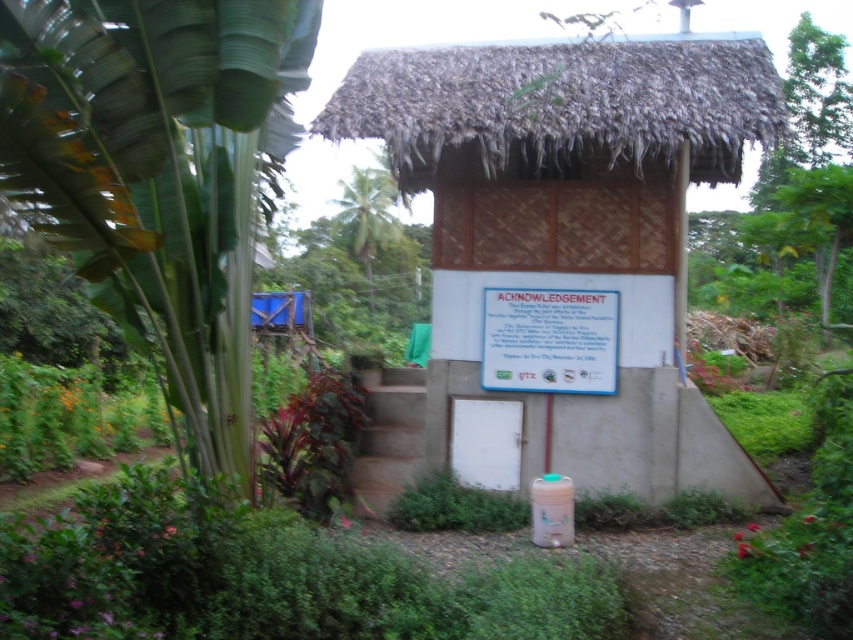
Question: Which point is closer to the camera taking this photo?

Choices:
 (A) (502, 310)
 (B) (358, 54)

Answer: (A)

Question: Which point is closer to the camera taking this photo?

Choices:
 (A) (701, 81)
 (B) (592, 378)

Answer: (A)

Question: Is thatched roof hut at center closer to the viewer compared to white paper at center?

Choices:
 (A) no
 (B) yes

Answer: (B)

Question: Can you confirm if thatched roof hut at center is positioned above white paper at center?

Choices:
 (A) no
 (B) yes

Answer: (B)

Question: Does thatched roof hut at center have a larger size compared to white paper at center?

Choices:
 (A) yes
 (B) no

Answer: (A)